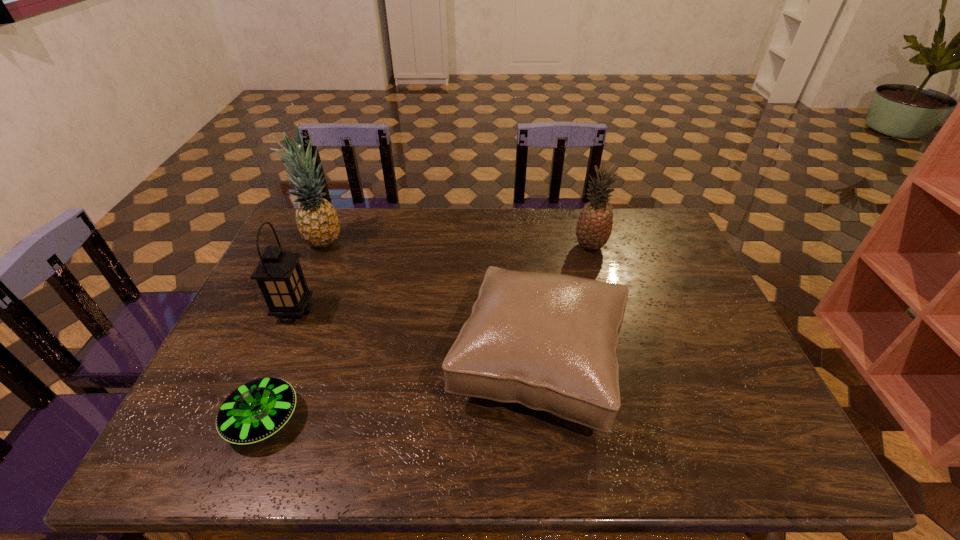
In the image, there is a desktop. Where is `vacant space at the left edge`? This screenshot has height=540, width=960. vacant space at the left edge is located at coordinates (257, 320).

You are a GUI agent. You are given a task and a screenshot of the screen. Output one action in this format:
    pyautogui.click(x=<x>, y=<y>)
    Task: Click on the vacant area at the right edge of the desktop
    The height and width of the screenshot is (540, 960).
    Given the screenshot: What is the action you would take?
    pyautogui.click(x=708, y=296)

The image size is (960, 540). Identify the location of vacant space at the near left corner of the desktop. (169, 467).

Locate an element on the screen. vacant space at the far right corner of the desktop is located at coordinates (618, 212).

In order to click on empty space that is in between the cushion and the taller pineapple in this screenshot , I will do `click(429, 302)`.

You are a GUI agent. You are given a task and a screenshot of the screen. Output one action in this format:
    pyautogui.click(x=<x>, y=<y>)
    Task: Click on the vacant region between the saucer and the lantern
    The width and height of the screenshot is (960, 540).
    Given the screenshot: What is the action you would take?
    (x=278, y=366)

Where is `empty location between the tallest object and the cushion`? The height and width of the screenshot is (540, 960). empty location between the tallest object and the cushion is located at coordinates (429, 302).

Find the location of `empty space between the right pineapple and the left pineapple`. empty space between the right pineapple and the left pineapple is located at coordinates pos(456,244).

Find the location of `vacant area that lies between the shortest object and the shorter pineapple`. vacant area that lies between the shortest object and the shorter pineapple is located at coordinates 426,333.

This screenshot has height=540, width=960. Find the location of `free space between the left pineapple and the right pineapple`. free space between the left pineapple and the right pineapple is located at coordinates (456, 244).